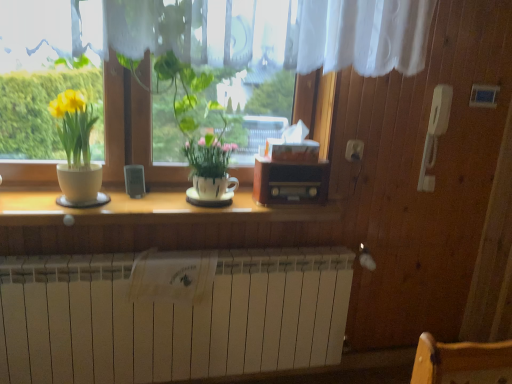
Locate an element on the screen. This screenshot has height=384, width=512. wooden radio at center is located at coordinates (290, 182).

Where is `white matte radiator at lower center`? white matte radiator at lower center is located at coordinates (170, 315).

In order to face wooden counter top at center, should I rotate leftwards or rightwards?

To align with it, rotate left about 10.749°.

Measure the distance between white glossy pot at center, which ranks as the 2th houseplant in left-to-right order, and camera.

white glossy pot at center, which ranks as the 2th houseplant in left-to-right order, is 4.70 feet from camera.

The width and height of the screenshot is (512, 384). Describe the element at coordinates (195, 126) in the screenshot. I see `white glossy pot at center, marked as the 1th houseplant in a right-to-left arrangement` at that location.

Locate an element on the screen. wooden radio at center is located at coordinates (290, 182).

Based on the photo, considering the sizes of objects wooden radio at center and white matte radiator at lower center in the image provided, who is taller, wooden radio at center or white matte radiator at lower center?

white matte radiator at lower center.

Considering the positions of objects wooden radio at center and white matte radiator at lower center in the image provided, who is in front, wooden radio at center or white matte radiator at lower center?

white matte radiator at lower center is closer to the camera.

Is wooden radio at center looking in the opposite direction of white matte radiator at lower center?

That's not correct — wooden radio at center is not looking away from white matte radiator at lower center.

What's the angular difference between wooden radio at center and white matte radiator at lower center's facing directions?

There is a 1.25-degree angle between the facing directions of wooden radio at center and white matte radiator at lower center.

Is wooden radio at center facing away from white glossy pot at center, marked as the 1th houseplant in a right-to-left arrangement?

No, wooden radio at center's orientation is not away from white glossy pot at center, marked as the 1th houseplant in a right-to-left arrangement.

Is wooden radio at center taller than white glossy pot at center, which ranks as the 2th houseplant in left-to-right order?

No, wooden radio at center is not taller than white glossy pot at center, which ranks as the 2th houseplant in left-to-right order.

Does wooden radio at center have a smaller size compared to white glossy pot at center, marked as the 1th houseplant in a right-to-left arrangement?

Yes.

From the wooden radio at center, count 1st houseplants forward and point to it. Please provide its 2D coordinates.

[(77, 152)]

Is wooden radio at center not near matte white pot at left, the 1th houseplant when ordered from left to right?

Actually, wooden radio at center and matte white pot at left, the 1th houseplant when ordered from left to right, are a little close together.

Who is taller, wooden radio at center or matte white pot at left, the 1th houseplant when ordered from left to right?

Standing taller between the two is matte white pot at left, the 1th houseplant when ordered from left to right.

Is wooden radio at center to the left of matte white pot at left, the 1th houseplant when ordered from left to right, from the viewer's perspective?

No, wooden radio at center is not to the left of matte white pot at left, the 1th houseplant when ordered from left to right.

From the image's perspective, is white glossy pot at center, marked as the 1th houseplant in a right-to-left arrangement, located above or below white matte radiator at lower center?

From the image's perspective, white glossy pot at center, marked as the 1th houseplant in a right-to-left arrangement, appears above white matte radiator at lower center.

Relative to white matte radiator at lower center, is white glossy pot at center, which ranks as the 2th houseplant in left-to-right order, in front or behind?

Clearly, white glossy pot at center, which ranks as the 2th houseplant in left-to-right order, is in front of white matte radiator at lower center.

Can you see white glossy pot at center, which ranks as the 2th houseplant in left-to-right order, touching white matte radiator at lower center?

No, white glossy pot at center, which ranks as the 2th houseplant in left-to-right order, is not beside white matte radiator at lower center.

From a real-world perspective, is white glossy pot at center, marked as the 1th houseplant in a right-to-left arrangement, physically below white matte radiator at lower center?

Actually, white glossy pot at center, marked as the 1th houseplant in a right-to-left arrangement, is physically above white matte radiator at lower center in the real world.

How many degrees apart are the facing directions of matte white pot at left, the 1th houseplant when ordered from left to right, and white glossy pot at center, which ranks as the 2th houseplant in left-to-right order?

matte white pot at left, the 1th houseplant when ordered from left to right, and white glossy pot at center, which ranks as the 2th houseplant in left-to-right order, are facing 1.84 degrees away from each other.

Can you confirm if matte white pot at left, the 1th houseplant when ordered from left to right, is taller than white glossy pot at center, which ranks as the 2th houseplant in left-to-right order?

Incorrect, the height of matte white pot at left, the 1th houseplant when ordered from left to right, is not larger of that of white glossy pot at center, which ranks as the 2th houseplant in left-to-right order.

I want to click on houseplant in front of the matte white pot at left, the 1th houseplant when ordered from left to right, so click(x=195, y=126).

From a real-world perspective, is matte white pot at left, the 1th houseplant when ordered from left to right, located beneath white glossy pot at center, marked as the 1th houseplant in a right-to-left arrangement?

Yes.

How distant is white matte radiator at lower center from wooden radio at center?

white matte radiator at lower center is 21.90 inches away from wooden radio at center.

From the picture: Could wooden radio at center be considered to be inside white matte radiator at lower center?

No, wooden radio at center is not surrounded by white matte radiator at lower center.

Between white matte radiator at lower center and wooden radio at center, which one has smaller size?

wooden radio at center is smaller.

Visually, is white matte radiator at lower center positioned to the left or to the right of wooden radio at center?

Based on their positions, white matte radiator at lower center is located to the left of wooden radio at center.

Is wooden radio at center facing towards wooden counter top at center?

No.

Is wooden radio at center to the left of wooden counter top at center from the viewer's perspective?

No.

Based on the photo, considering the positions of objects wooden radio at center and wooden counter top at center in the image provided, who is in front, wooden radio at center or wooden counter top at center?

wooden counter top at center is in front.

This screenshot has height=384, width=512. I want to click on window box behind the white matte radiator at lower center, so click(290, 182).

From a real-world perspective, which houseplant is the 2nd one above the wooden radio at center? Please provide its 2D coordinates.

[(195, 126)]

From the picture: Looking at the image, which one is located further to wooden counter top at center, wooden radio at center or white glossy pot at center, which ranks as the 2th houseplant in left-to-right order?

The object further to wooden counter top at center is white glossy pot at center, which ranks as the 2th houseplant in left-to-right order.

From the picture: Considering their positions, is white matte radiator at lower center positioned further to white glossy pot at center, marked as the 1th houseplant in a right-to-left arrangement, than matte white pot at left, the 2th houseplant viewed from the right?

white matte radiator at lower center is further to white glossy pot at center, marked as the 1th houseplant in a right-to-left arrangement.

Based on their spatial positions, is white matte radiator at lower center or wooden counter top at center closer to white glossy pot at center, marked as the 1th houseplant in a right-to-left arrangement?

Based on the image, wooden counter top at center appears to be nearer to white glossy pot at center, marked as the 1th houseplant in a right-to-left arrangement.

Based on the photo, estimate the real-world distances between objects in this image. Which object is further from matte white pot at left, the 2th houseplant viewed from the right, wooden counter top at center or wooden radio at center?

wooden radio at center is positioned further to the anchor matte white pot at left, the 2th houseplant viewed from the right.

Estimate the real-world distances between objects in this image. Which object is further from white glossy pot at center, which ranks as the 2th houseplant in left-to-right order, matte white pot at left, the 1th houseplant when ordered from left to right, or wooden radio at center?

matte white pot at left, the 1th houseplant when ordered from left to right, is positioned further to the anchor white glossy pot at center, which ranks as the 2th houseplant in left-to-right order.

Looking at the image, which one is located further to white glossy pot at center, which ranks as the 2th houseplant in left-to-right order, wooden counter top at center or matte white pot at left, the 2th houseplant viewed from the right?

matte white pot at left, the 2th houseplant viewed from the right, lies further to white glossy pot at center, which ranks as the 2th houseplant in left-to-right order, than the other object.

From the image, which object appears to be farther from wooden counter top at center, matte white pot at left, the 1th houseplant when ordered from left to right, or white glossy pot at center, which ranks as the 2th houseplant in left-to-right order?

white glossy pot at center, which ranks as the 2th houseplant in left-to-right order, is positioned further to the anchor wooden counter top at center.

Considering their positions, is white glossy pot at center, which ranks as the 2th houseplant in left-to-right order, positioned closer to wooden counter top at center than matte white pot at left, the 1th houseplant when ordered from left to right?

matte white pot at left, the 1th houseplant when ordered from left to right, lies closer to wooden counter top at center than the other object.

Where is `houseplant between wooden counter top at center and wooden radio at center from left to right`? The width and height of the screenshot is (512, 384). houseplant between wooden counter top at center and wooden radio at center from left to right is located at coordinates click(x=195, y=126).

Locate an element on the screen. The height and width of the screenshot is (384, 512). houseplant situated between matte white pot at left, the 2th houseplant viewed from the right, and wooden radio at center from left to right is located at coordinates (195, 126).

The width and height of the screenshot is (512, 384). I want to click on counter top between white glossy pot at center, which ranks as the 2th houseplant in left-to-right order, and white matte radiator at lower center from top to bottom, so click(x=152, y=210).

Locate an element on the screen. This screenshot has width=512, height=384. radiator situated between matte white pot at left, the 1th houseplant when ordered from left to right, and wooden radio at center from left to right is located at coordinates (170, 315).